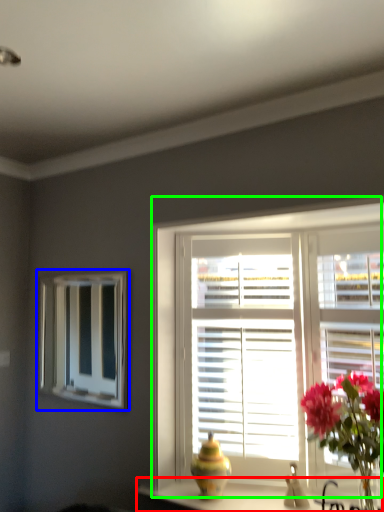
Question: Considering the real-world distances, which object is farthest from counter top (highlighted by a red box)? bay window (highlighted by a blue box) or window (highlighted by a green box)?

Choices:
 (A) bay window
 (B) window

Answer: (A)